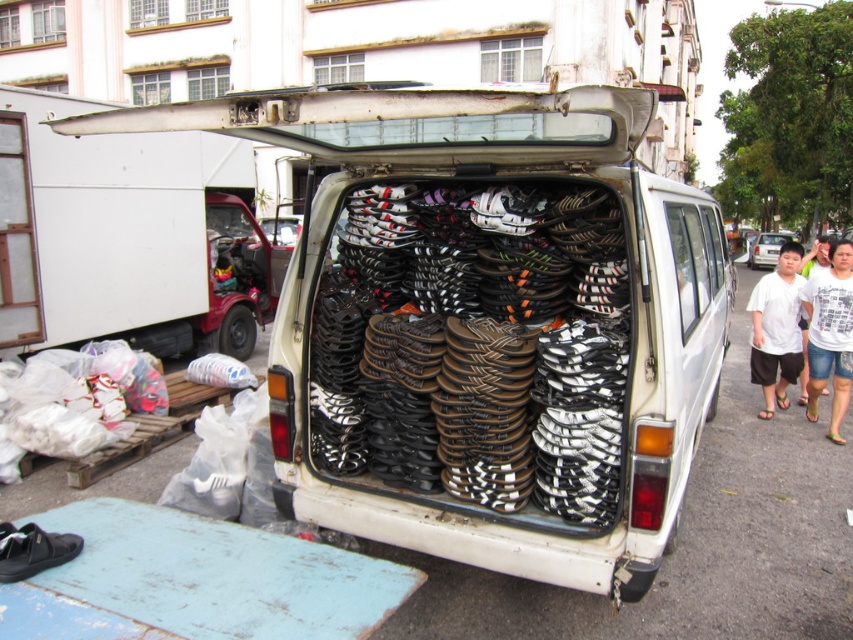
The width and height of the screenshot is (853, 640). Identify the location of black matte sandals at center. (485, 323).

From the picture: Who is taller, black matte sandals at center or black rubber tire at right?

black matte sandals at center is taller.

The height and width of the screenshot is (640, 853). What do you see at coordinates (485, 323) in the screenshot?
I see `black matte sandals at center` at bounding box center [485, 323].

You are a GUI agent. You are given a task and a screenshot of the screen. Output one action in this format:
    pyautogui.click(x=<x>, y=<y>)
    Task: Click on the black matte sandals at center
    The height and width of the screenshot is (640, 853).
    Given the screenshot: What is the action you would take?
    pyautogui.click(x=485, y=323)

Describe the element at coordinates (830, 336) in the screenshot. The height and width of the screenshot is (640, 853). I see `white fabric shirt at right` at that location.

Between point (816, 278) and point (225, 321), which one is positioned in front?

Point (816, 278) is in front.

You are a GUI agent. You are given a task and a screenshot of the screen. Output one action in this format:
    pyautogui.click(x=<x>, y=<y>)
    Task: Click on the white fabric shirt at right
    This screenshot has width=853, height=640.
    Given the screenshot: What is the action you would take?
    pyautogui.click(x=830, y=336)

Which is above, black matte sandals at center or black rubber sandals at center?

black matte sandals at center is higher up.

Who is taller, black matte sandals at center or black rubber sandals at center?

black matte sandals at center

Is point (393, 147) closer to camera compared to point (328, 384)?

Yes, point (393, 147) is closer to viewer.

Image resolution: width=853 pixels, height=640 pixels. Identify the location of black matte sandals at center. (485, 323).